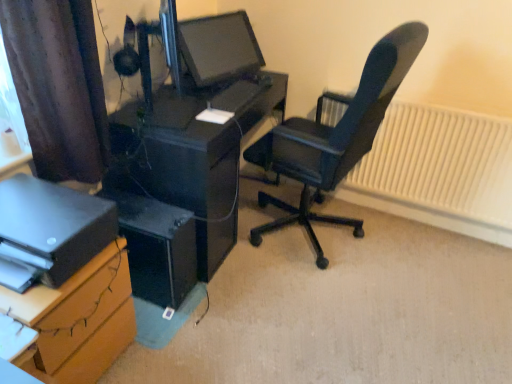
Question: From their relative heights in the image, would you say black plastic computer tower at lower left is taller or shorter than brown cardboard at lower left, which appears as the first desk when viewed from the front?

Choices:
 (A) tall
 (B) short

Answer: (B)

Question: Considering the relative positions of black plastic computer tower at lower left and brown cardboard at lower left, which appears as the first desk when viewed from the front, in the image provided, is black plastic computer tower at lower left to the left or to the right of brown cardboard at lower left, which appears as the first desk when viewed from the front,?

Choices:
 (A) right
 (B) left

Answer: (A)

Question: Estimate the real-world distances between objects in this image. Which object is closer to the brown fabric curtain at upper left?

Choices:
 (A) white textured radiator at right
 (B) black leather office chair at right
 (C) black plastic computer tower at lower left
 (D) brown cardboard at lower left, which appears as the first desk when viewed from the front
 (E) black glossy desk at center, acting as the 2th desk starting from the front

Answer: (E)

Question: Estimate the real-world distances between objects in this image. Which object is closer to the black plastic computer tower at lower left?

Choices:
 (A) brown fabric curtain at upper left
 (B) matte black printer at lower left
 (C) white textured radiator at right
 (D) black leather office chair at right
 (E) matte black monitor at center

Answer: (B)